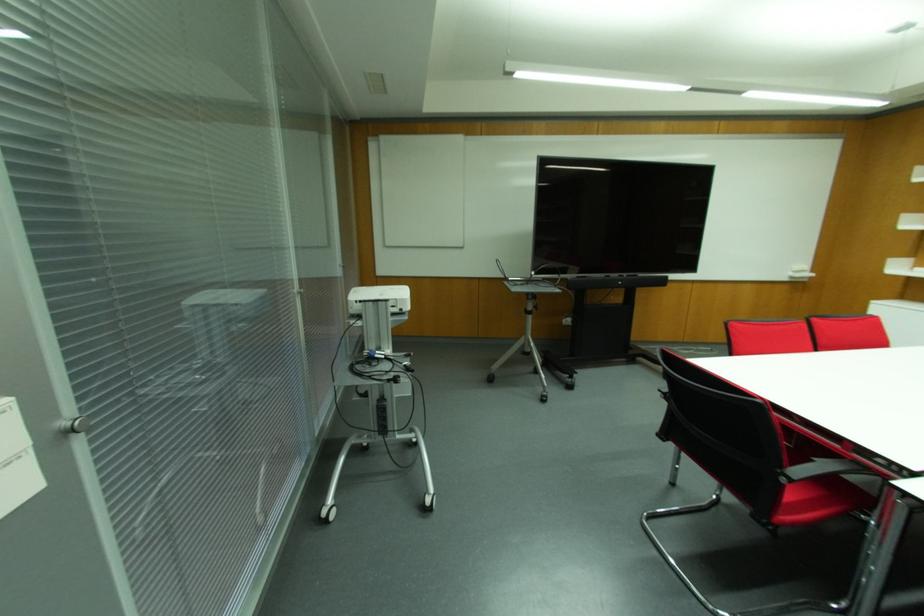
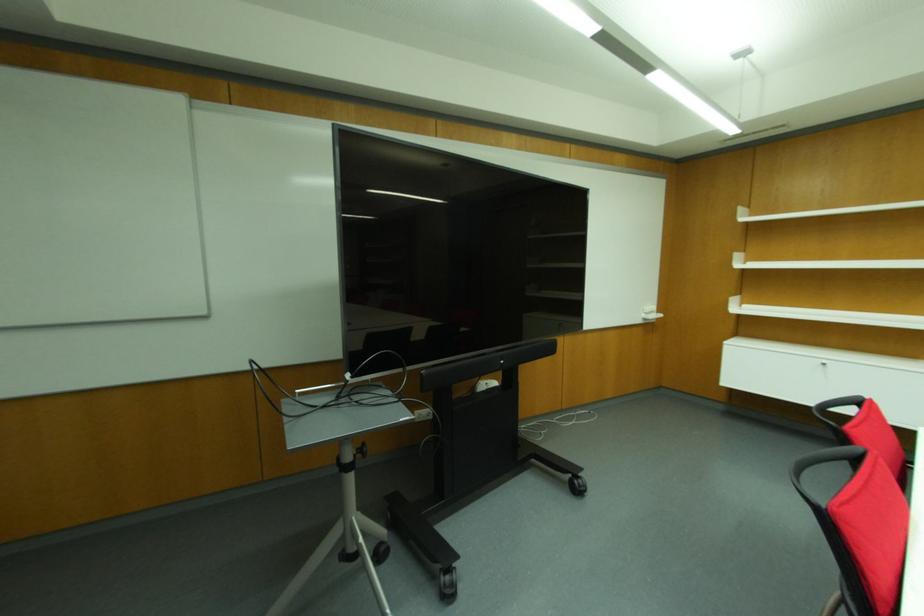
Question: In a continuous first-person perspective shot, in which direction is the camera moving?

Choices:
 (A) Left
 (B) Right
 (C) Forward
 (D) Backward

Answer: (C)